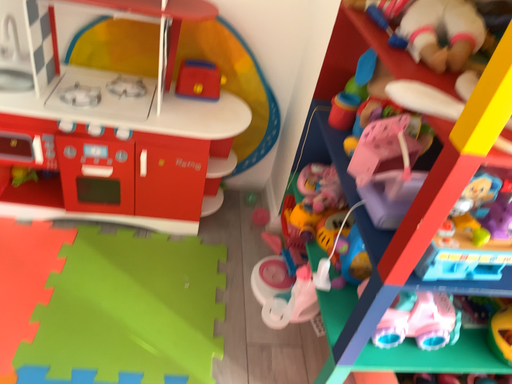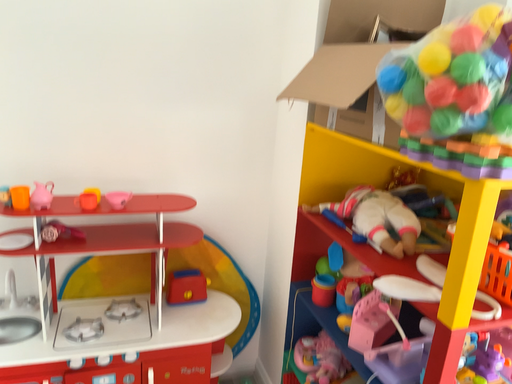
Question: Which way did the camera rotate in the video?

Choices:
 (A) rotated right
 (B) rotated left

Answer: (A)